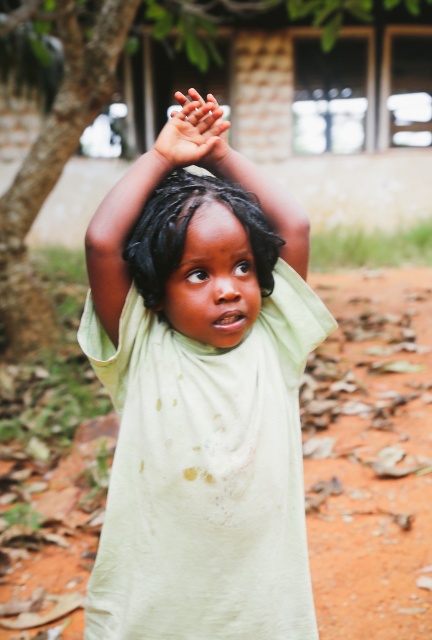
You are a photographer setting up a shoot in the rural area shown. You need to place a reflector to catch sunlight from the green leafy tree at upper left. Since the light green fabric at center is already positioned under the tree, where should you place the reflector to best utilize the sunlight?

The light green fabric at center is positioned under the green leafy tree at upper left, so placing the reflector opposite the tree would help catch and reflect sunlight onto the fabric.

You are a tailor who needs to choose between the light green fabric at center and the green leafy tree at upper left for a project that requires a material that can withstand heavy use. Which object would you select and why?

The green leafy tree at upper left is thicker than the light green fabric at center, so it is more durable and better suited for projects requiring heavy use.

In the scene shown: The child is standing near a green leafy tree at upper left. If the child wants to pick an apple from the tree, which direction should they move towards?

The child should move towards the green leafy tree at upper left to pick the apple since it is the closest object in that direction.